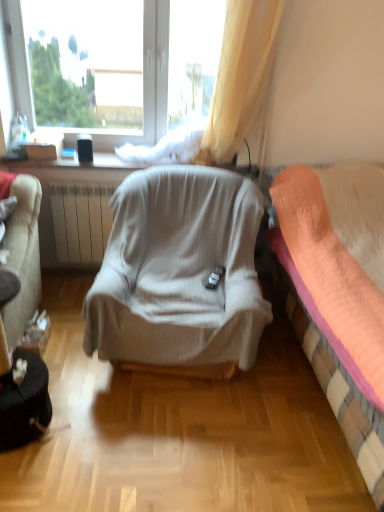
Question: Looking at the image, does orange fabric bed at right seem bigger or smaller compared to transparent plastic window at upper center?

Choices:
 (A) small
 (B) big

Answer: (B)

Question: From a real-world perspective, relative to transparent plastic window at upper center, is orange fabric bed at right vertically above or below?

Choices:
 (A) above
 (B) below

Answer: (B)

Question: Which object is the farthest from the orange fabric bed at right?

Choices:
 (A) light gray fabric chair at center
 (B) transparent plastic window at upper center

Answer: (B)

Question: Estimate the real-world distances between objects in this image. Which object is farther from the light gray fabric chair at center?

Choices:
 (A) transparent plastic window at upper center
 (B) orange fabric bed at right

Answer: (A)